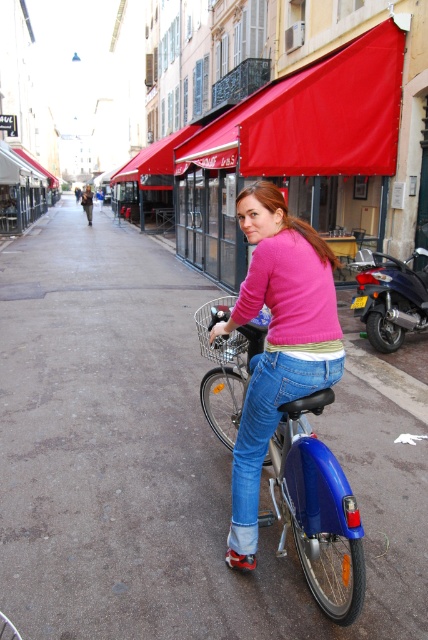
In the scene shown: You are a delivery person who needs to carry a package that is 1.5 meters wide. You see the blue metallic bicycle at center and the jeans at center in the image. Which object can fit the package based on their widths?

The blue metallic bicycle at center has a width less than the jeans at center, so the package can fit on the jeans at center since it is wider.